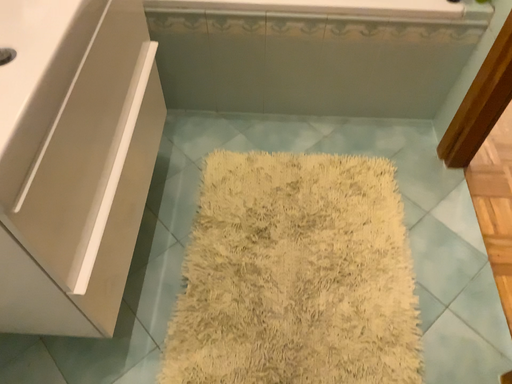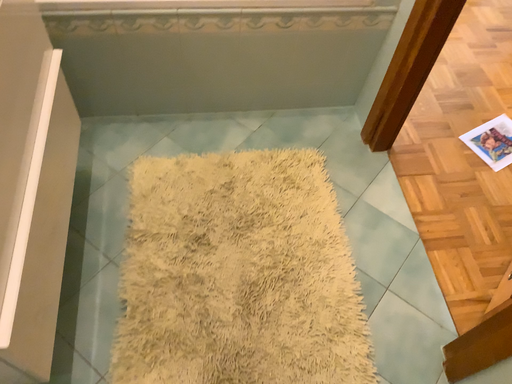
Question: Which way did the camera rotate in the video?

Choices:
 (A) rotated right
 (B) rotated left

Answer: (A)